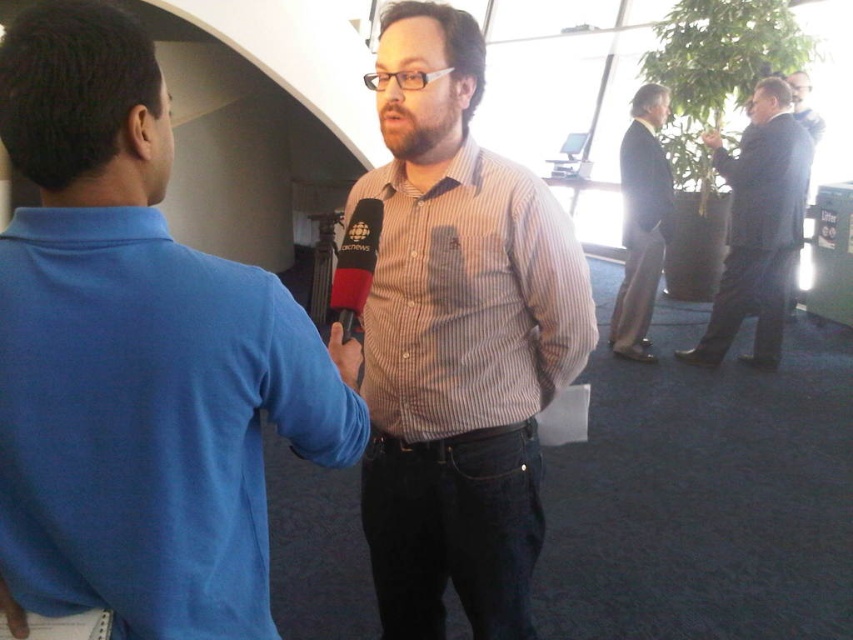
You are standing in the modern office or conference area depicted in the image. You need to locate the point at coordinates (x=135, y=356). Which object is this point located on?

The point at coordinates (x=135, y=356) is located on the blue cotton shirt at center.

You are an office assistant who needs to locate two specific attendees for a meeting. You see the brown striped shirt at center and the dark brown suit at upper right. Which one is positioned lower in the image?

The brown striped shirt at center is located below dark brown suit at upper right, so the brown striped shirt at center is positioned lower in the image.